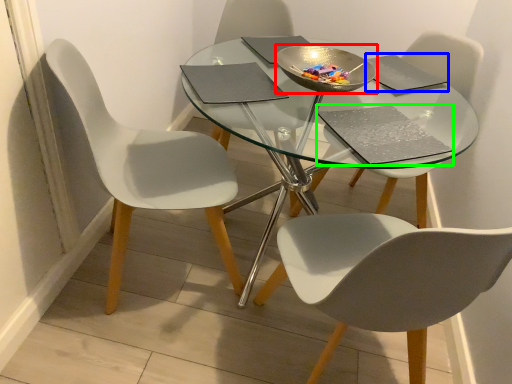
Question: Based on their relative distances, which object is farther from bowl (highlighted by a red box)? Choose from pad (highlighted by a blue box) and pad (highlighted by a green box).

Choices:
 (A) pad
 (B) pad

Answer: (B)